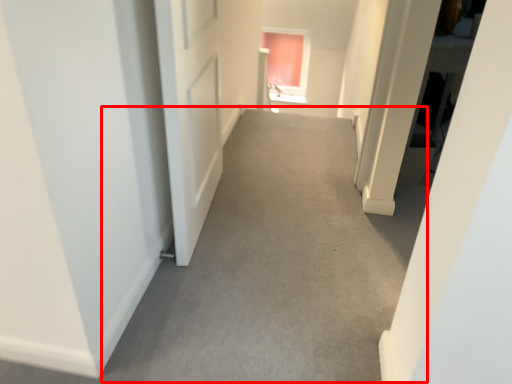
Question: From the image's perspective, where is alley (annotated by the red box) located relative to window?

Choices:
 (A) above
 (B) below

Answer: (B)